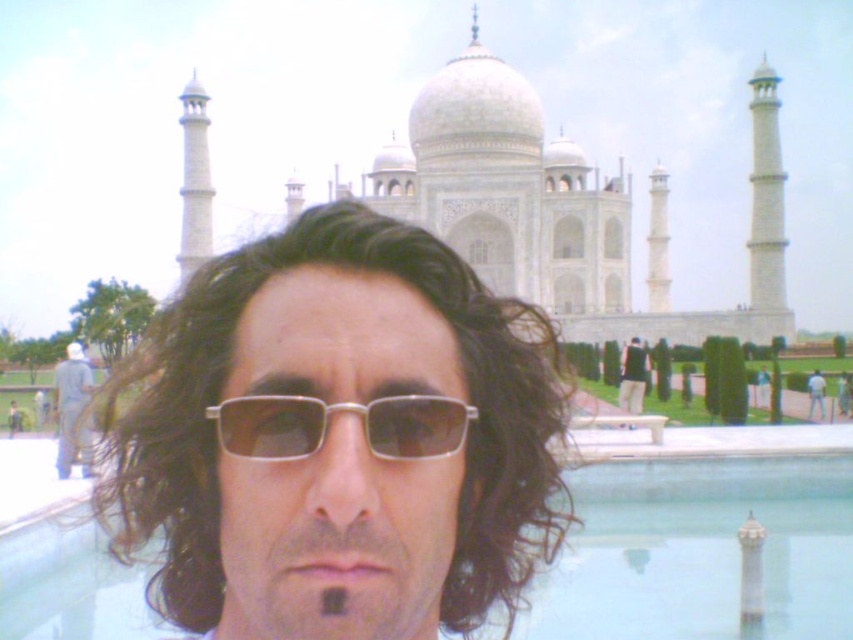
You are standing in front of the Taj Mahal and see a clear glass pool at center and a white matte baseball uniform at center. Which object is bigger?

The clear glass pool at center is larger in size than the white matte baseball uniform at center.

You are standing in front of the Taj Mahal and see a person with rectangular sunglasses at center. Where is the point located at coordinate (x=328, y=426)?

The point at coordinate (x=328, y=426) is on the silver metallic glasses at center.